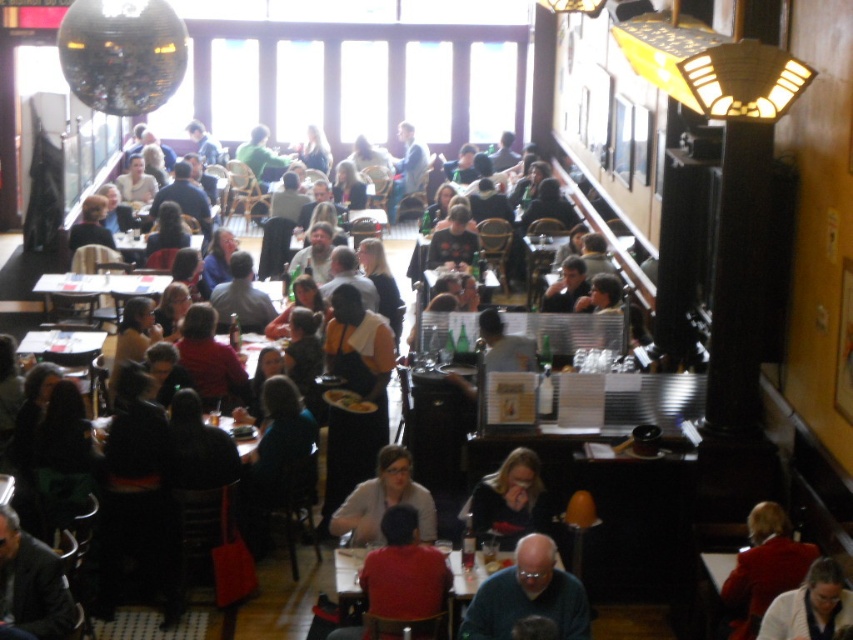
You are a customer in the restaurant and want to sit at the white plastic table at center. However, there is a person wearing a matte gray shirt at center blocking your path. Can you walk around them to reach the table?

The matte gray shirt at center is behind the white plastic table at center, so the person is already behind the table. Therefore, you can walk directly to the table without needing to go around the person.

You are a customer entering the restaurant and see the red velvet coat at lower right and the matte gray sweater at center. Which item of clothing is bigger?

The red velvet coat at lower right is larger in size than the matte gray sweater at center.